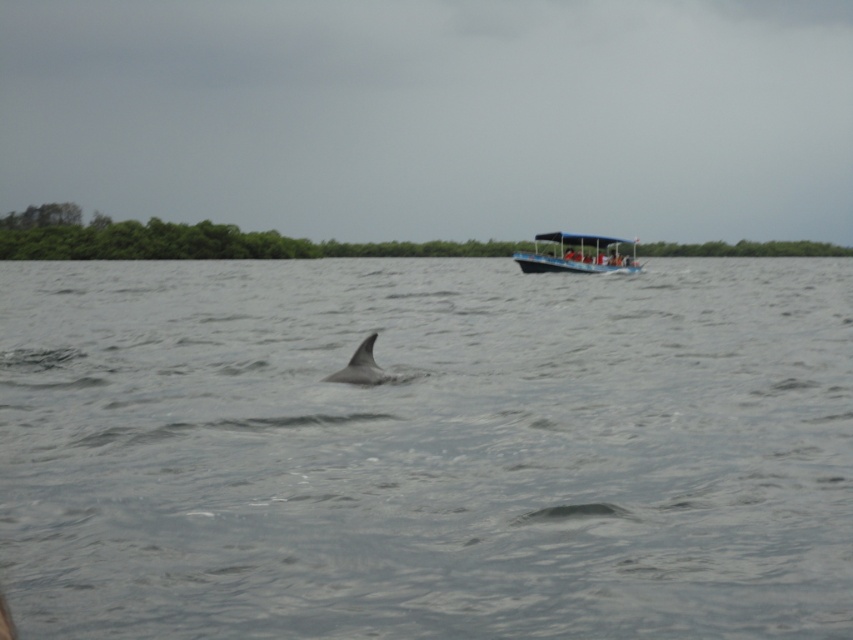
Can you confirm if gray matte water at center is positioned to the left of blue plastic boat at upper right?

Yes, gray matte water at center is to the left of blue plastic boat at upper right.

Does gray matte water at center have a greater width compared to blue plastic boat at upper right?

Correct, the width of gray matte water at center exceeds that of blue plastic boat at upper right.

This screenshot has width=853, height=640. Identify the location of gray matte water at center. (426, 449).

Who is higher up, blue plastic boat at upper right or gray matte dolphin at center?

blue plastic boat at upper right is above.

Who is shorter, blue plastic boat at upper right or gray matte dolphin at center?

blue plastic boat at upper right

Measure the distance between point (538,237) and camera.

They are 56.23 meters apart.

This screenshot has height=640, width=853. What are the coordinates of `blue plastic boat at upper right` in the screenshot? It's located at (578, 253).

Between gray matte water at center and gray matte dolphin at center, which one has less height?

With less height is gray matte dolphin at center.

Which is more to the left, gray matte water at center or gray matte dolphin at center?

From the viewer's perspective, gray matte dolphin at center appears more on the left side.

You are a GUI agent. You are given a task and a screenshot of the screen. Output one action in this format:
    pyautogui.click(x=<x>, y=<y>)
    Task: Click on the gray matte water at center
    This screenshot has width=853, height=640.
    Given the screenshot: What is the action you would take?
    pyautogui.click(x=426, y=449)

Find the location of a particular element. gray matte water at center is located at coordinates (426, 449).